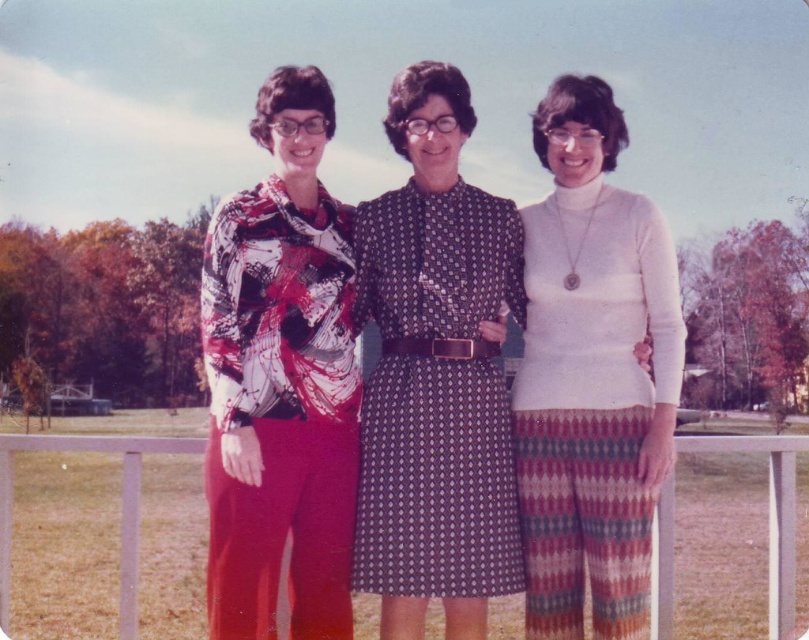
Does white knitwear at center appear on the right side of printed fabric dress at center?

Indeed, white knitwear at center is positioned on the right side of printed fabric dress at center.

Can you confirm if white knitwear at center is positioned above printed fabric dress at center?

Correct, white knitwear at center is located above printed fabric dress at center.

Based on the photo, measure the distance between point (612, 225) and camera.

20.58 feet

This screenshot has height=640, width=809. What are the coordinates of `white knitwear at center` in the screenshot? It's located at (591, 374).

Between printed silk blouse at left and printed fabric dress at center, which one is positioned lower?

Positioned lower is printed silk blouse at left.

Is printed silk blouse at left below printed fabric dress at center?

Correct, printed silk blouse at left is located below printed fabric dress at center.

The width and height of the screenshot is (809, 640). Identify the location of printed silk blouse at left. (282, 380).

Is printed silk blouse at left further to the viewer compared to white knitwear at center?

Yes, it is behind white knitwear at center.

I want to click on printed silk blouse at left, so click(282, 380).